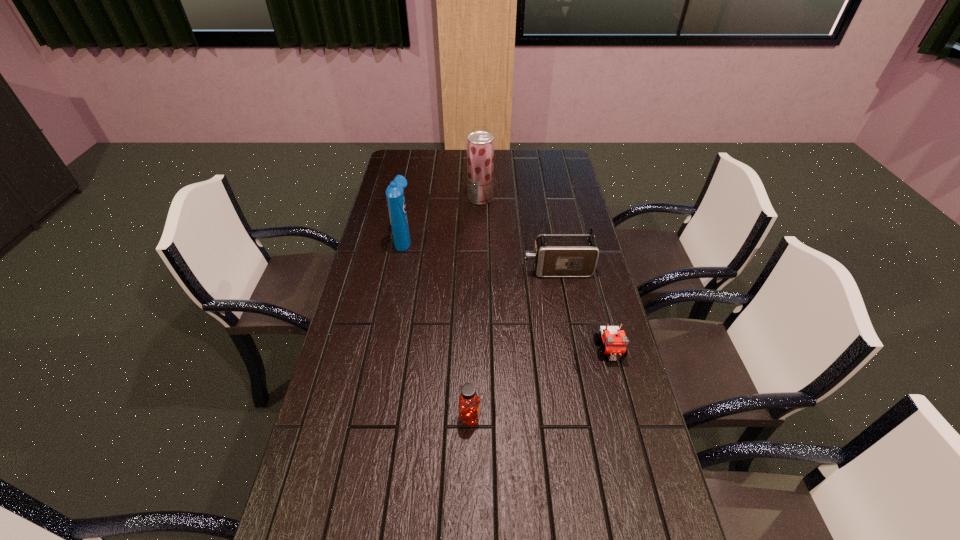
You are a GUI agent. You are given a task and a screenshot of the screen. Output one action in this format:
    pyautogui.click(x=<x>, y=<y>)
    Task: Click on the vacant region located 0.280m on the back of the second farthest object
    The width and height of the screenshot is (960, 540).
    Given the screenshot: What is the action you would take?
    click(414, 187)

This screenshot has width=960, height=540. I want to click on vacant space situated at the lens of the camcorder, so click(x=432, y=270).

Where is `vacant space located at the lens of the camcorder`? This screenshot has width=960, height=540. vacant space located at the lens of the camcorder is located at coordinates (469, 270).

Find the location of a particular element. blank space located at the lens of the camcorder is located at coordinates tap(409, 270).

In order to click on blank space located on the front label of the nearest object in this screenshot , I will do `click(616, 417)`.

The image size is (960, 540). Find the location of `free spot located on the front-facing side of the second nearest object`. free spot located on the front-facing side of the second nearest object is located at coordinates 653,516.

Image resolution: width=960 pixels, height=540 pixels. In order to click on object that is at the left edge in this screenshot , I will do `click(395, 197)`.

The height and width of the screenshot is (540, 960). What are the coordinates of `camcorder that is at the right edge` in the screenshot? It's located at [555, 255].

In order to click on Lego that is at the right edge in this screenshot , I will do `click(615, 341)`.

At what (x,y) coordinates should I click in order to perform the action: click on vacant space at the far edge of the desktop. Please return your answer as a coordinate pair (x, y). This screenshot has width=960, height=540. Looking at the image, I should click on (532, 176).